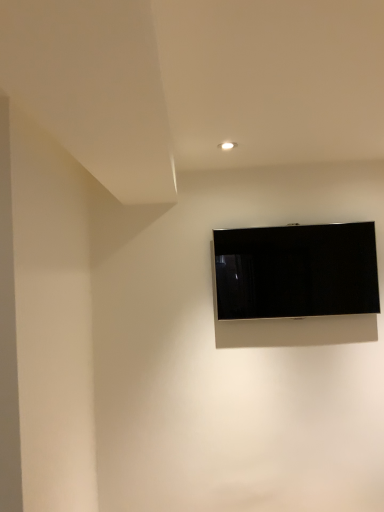
Measure the distance between matte black tv at center and camera.

matte black tv at center and camera are 2.37 meters apart.

This screenshot has width=384, height=512. What do you see at coordinates (296, 271) in the screenshot?
I see `matte black tv at center` at bounding box center [296, 271].

Locate an element on the screen. The image size is (384, 512). matte black tv at center is located at coordinates (296, 271).

Locate an element on the screen. This screenshot has height=512, width=384. matte black tv at center is located at coordinates (296, 271).